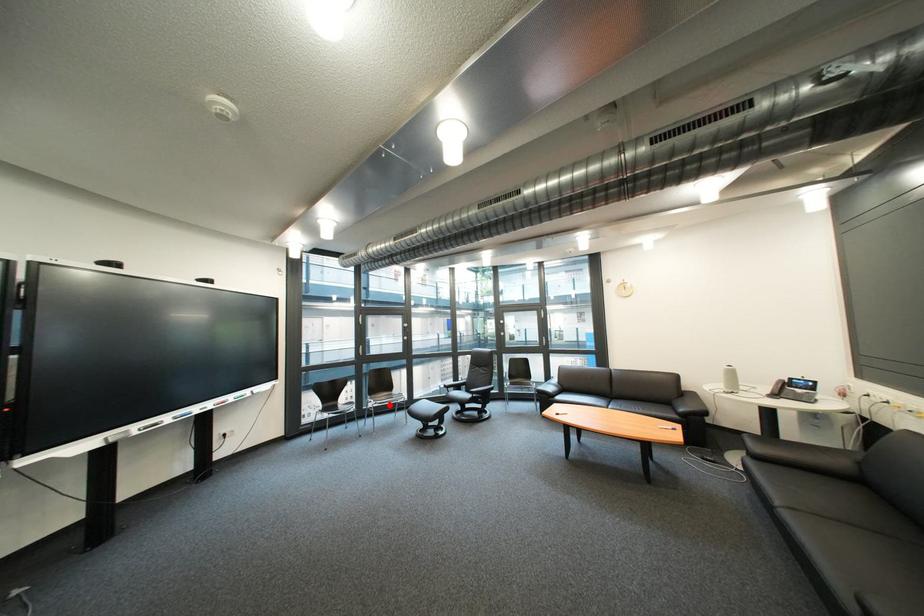
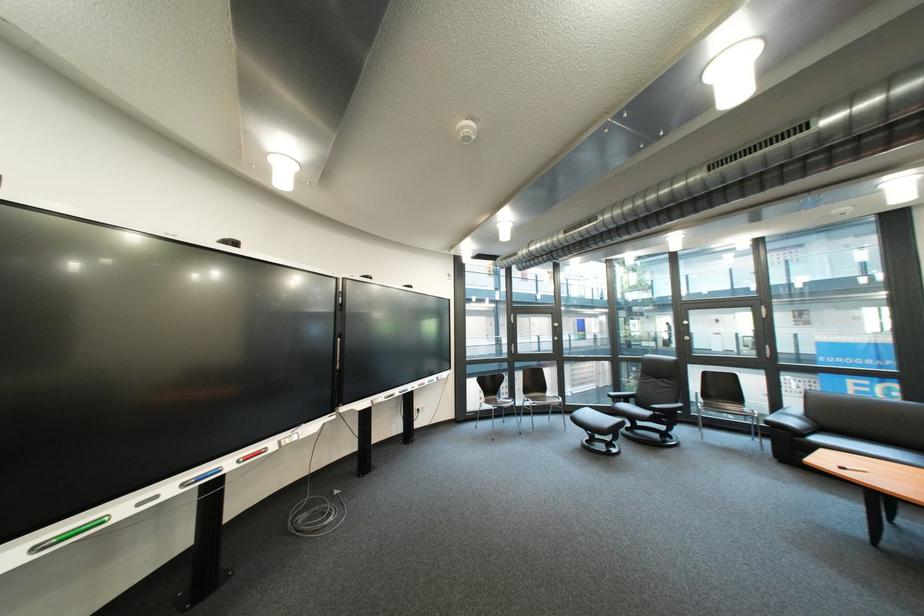
Question: I am providing you with two images of the same scene from different viewpoints. Image1 has a red point marked. In image2, the corresponding 3D location appears at what relative position? Reply with the corresponding letter.

Choices:
 (A) Closer
 (B) Farther

Answer: (A)